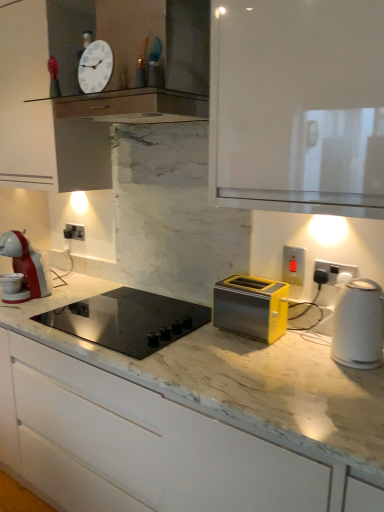
Question: Considering the relative sizes of matte plastic switch at upper right, the 2th electric outlet positioned from the right, and white glossy clock at upper center in the image provided, is matte plastic switch at upper right, the 2th electric outlet positioned from the right, taller than white glossy clock at upper center?

Choices:
 (A) no
 (B) yes

Answer: (A)

Question: From a real-world perspective, is matte plastic switch at upper right, which appears as the second electric outlet when viewed from the front, positioned under white glossy clock at upper center based on gravity?

Choices:
 (A) no
 (B) yes

Answer: (B)

Question: Is matte plastic switch at upper right, the 2th electric outlet positioned from the right, at the right side of white glossy clock at upper center?

Choices:
 (A) no
 (B) yes

Answer: (B)

Question: Is matte plastic switch at upper right, the 2th electric outlet positioned from the right, wider than white glossy clock at upper center?

Choices:
 (A) no
 (B) yes

Answer: (A)

Question: From the image's perspective, would you say matte plastic switch at upper right, the 2th electric outlet in the left-to-right sequence, is positioned over white glossy clock at upper center?

Choices:
 (A) yes
 (B) no

Answer: (B)

Question: Considering the relative positions of white glossy cabinet at upper center, marked as the 1th cabinetry in a top-to-bottom arrangement, and white glossy clock at upper center in the image provided, is white glossy cabinet at upper center, marked as the 1th cabinetry in a top-to-bottom arrangement, to the left or to the right of white glossy clock at upper center?

Choices:
 (A) right
 (B) left

Answer: (A)

Question: From the image's perspective, relative to white glossy clock at upper center, is white glossy cabinet at upper center, the second cabinetry when ordered from bottom to top, above or below?

Choices:
 (A) above
 (B) below

Answer: (A)

Question: In terms of size, does white glossy cabinet at upper center, marked as the 1th cabinetry in a top-to-bottom arrangement, appear bigger or smaller than white glossy clock at upper center?

Choices:
 (A) big
 (B) small

Answer: (A)

Question: From a real-world perspective, relative to white glossy clock at upper center, is white glossy cabinet at upper center, the second cabinetry when ordered from bottom to top, vertically above or below?

Choices:
 (A) above
 (B) below

Answer: (B)

Question: In terms of width, does white glossy cabinet at upper center, the second cabinetry when ordered from bottom to top, look wider or thinner when compared to yellow metallic toaster at center, the 2th cabinetry in the top-to-bottom sequence?

Choices:
 (A) thin
 (B) wide

Answer: (A)

Question: In terms of height, does white glossy cabinet at upper center, marked as the 1th cabinetry in a top-to-bottom arrangement, look taller or shorter compared to yellow metallic toaster at center, the 2th cabinetry in the top-to-bottom sequence?

Choices:
 (A) short
 (B) tall

Answer: (A)

Question: Is white glossy cabinet at upper center, marked as the 1th cabinetry in a top-to-bottom arrangement, in front of or behind yellow metallic toaster at center, the 2th cabinetry in the top-to-bottom sequence, in the image?

Choices:
 (A) behind
 (B) front

Answer: (A)

Question: Visually, is white glossy cabinet at upper center, the second cabinetry when ordered from bottom to top, positioned to the left or to the right of yellow metallic toaster at center, marked as the 1th cabinetry in a bottom-to-top arrangement?

Choices:
 (A) right
 (B) left

Answer: (A)

Question: Considering the positions of black glass cooktop at center and white plastic electric outlet at right, positioned as the first electric outlet in right-to-left order, in the image, is black glass cooktop at center wider or thinner than white plastic electric outlet at right, positioned as the first electric outlet in right-to-left order,?

Choices:
 (A) thin
 (B) wide

Answer: (B)

Question: Considering the positions of black glass cooktop at center and white plastic electric outlet at right, the 3th electric outlet from the left, in the image, is black glass cooktop at center taller or shorter than white plastic electric outlet at right, the 3th electric outlet from the left,?

Choices:
 (A) tall
 (B) short

Answer: (A)